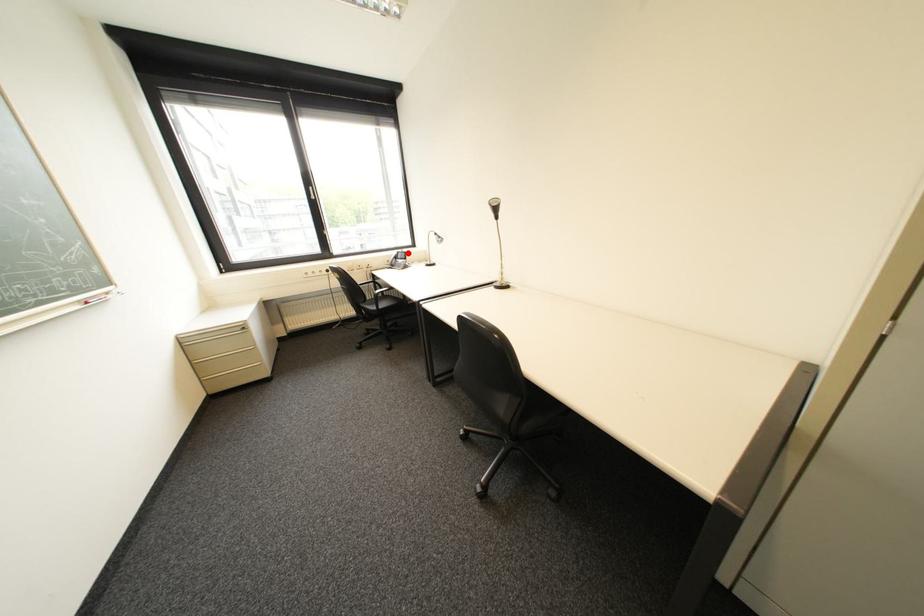
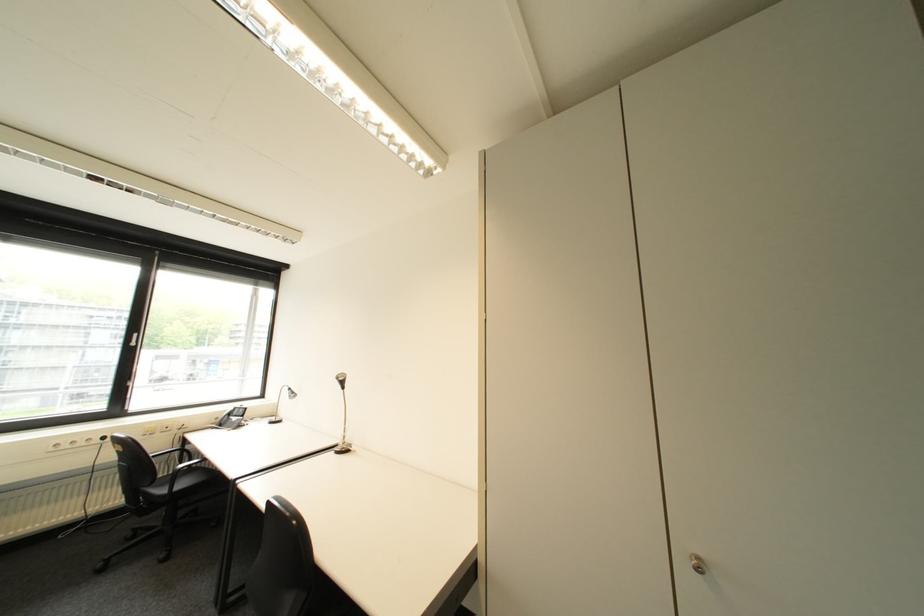
Locate, in the second image, the point that corresponds to the highlighted location in the first image.

(246, 408)